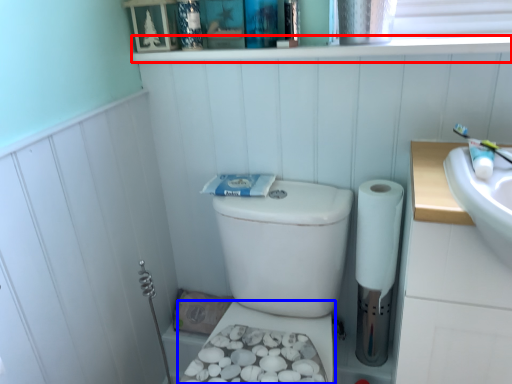
Question: Which object is closer to the camera taking this photo, ledge (highlighted by a red box) or bidet (highlighted by a blue box)?

Choices:
 (A) ledge
 (B) bidet

Answer: (A)